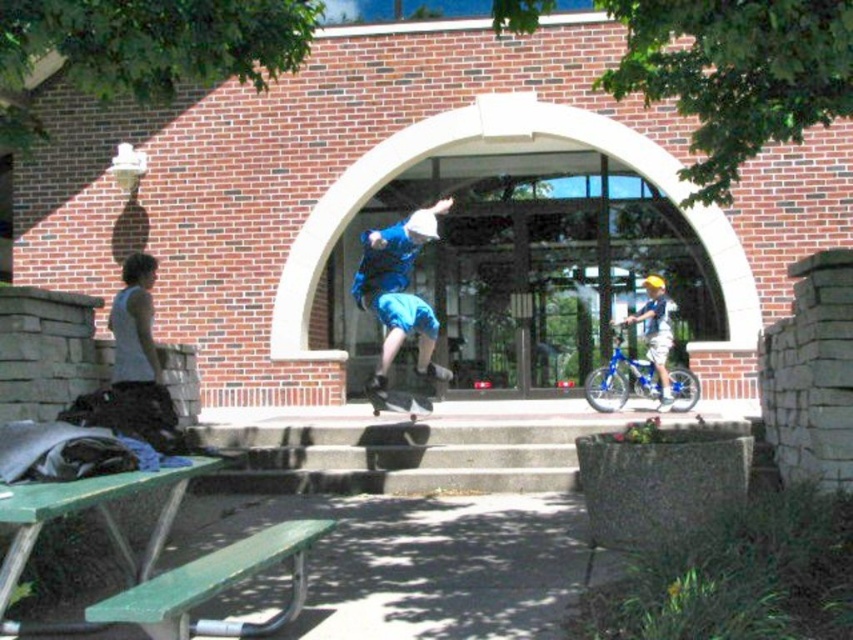
You are a photographer positioned at the bottom of the steps. You want to capture a photo that includes both the light blue denim shorts at right and the black smooth skateboard at center. Which object should you adjust your camera angle to focus on first to ensure both are in frame?

The black smooth skateboard at center is behind the light blue denim shorts at right, so you should focus on the light blue denim shorts at right first to ensure the skateboard behind it is also captured in the frame.

You are a photographer wanting to capture both the light blue denim shorts at right and the black smooth skateboard at center in a single frame. Since you want to ensure both are visible, which object should you focus on to account for their sizes?

The light blue denim shorts at right has a lesser width compared to the black smooth skateboard at center, so you should focus on the black smooth skateboard at center since it is larger and will require more attention in the frame.

Consider the image. You are a photographer wanting to capture both the green painted wood park bench at lower left and the black smooth skateboard at center in the same frame. Which object should you focus on first to ensure both are in the frame?

The green painted wood park bench at lower left is much taller than the black smooth skateboard at center, so focusing on the bench first will help ensure both are included in the frame.